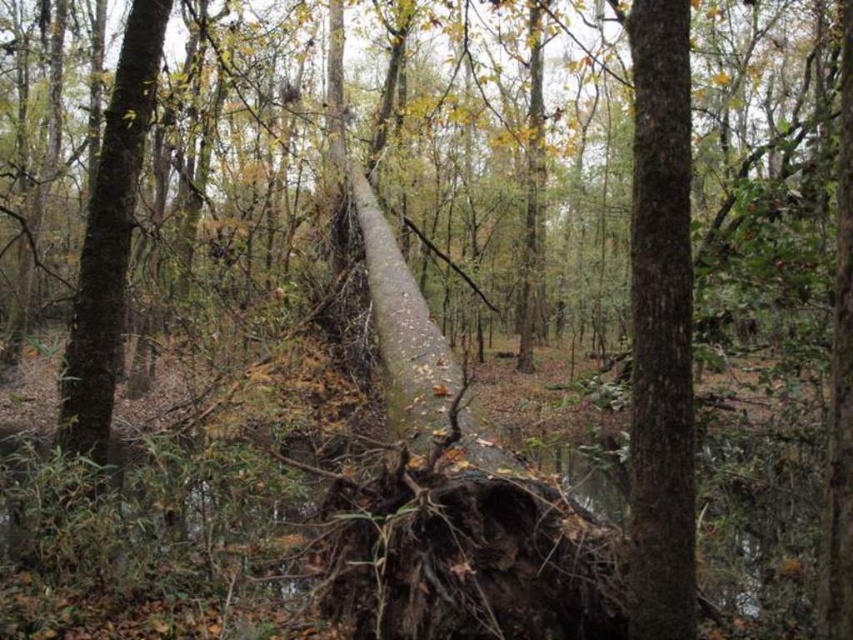
Question: Which point is farther from the camera taking this photo?

Choices:
 (A) (96, 250)
 (B) (675, 528)

Answer: (A)

Question: Considering the relative positions of smooth brown tree trunk at center and brown rough tree trunk at center in the image provided, where is smooth brown tree trunk at center located with respect to brown rough tree trunk at center?

Choices:
 (A) left
 (B) right

Answer: (B)

Question: Does smooth brown tree trunk at center have a larger size compared to brown rough tree trunk at center?

Choices:
 (A) no
 (B) yes

Answer: (A)

Question: Can you confirm if smooth brown tree trunk at center is smaller than brown rough tree trunk at center?

Choices:
 (A) no
 (B) yes

Answer: (B)